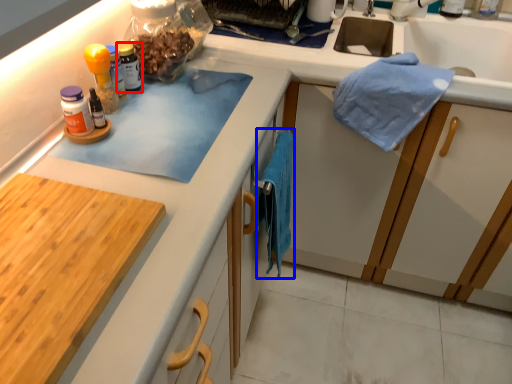
Question: Among these objects, which one is nearest to the camera, bottle (highlighted by a red box) or bath towel (highlighted by a blue box)?

Choices:
 (A) bottle
 (B) bath towel

Answer: (B)